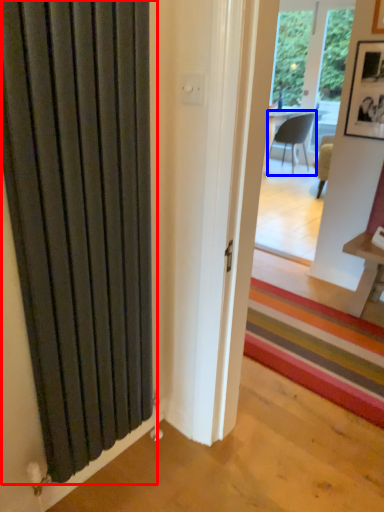
Question: Among these objects, which one is nearest to the camera, door (highlighted by a red box) or chair (highlighted by a blue box)?

Choices:
 (A) door
 (B) chair

Answer: (A)